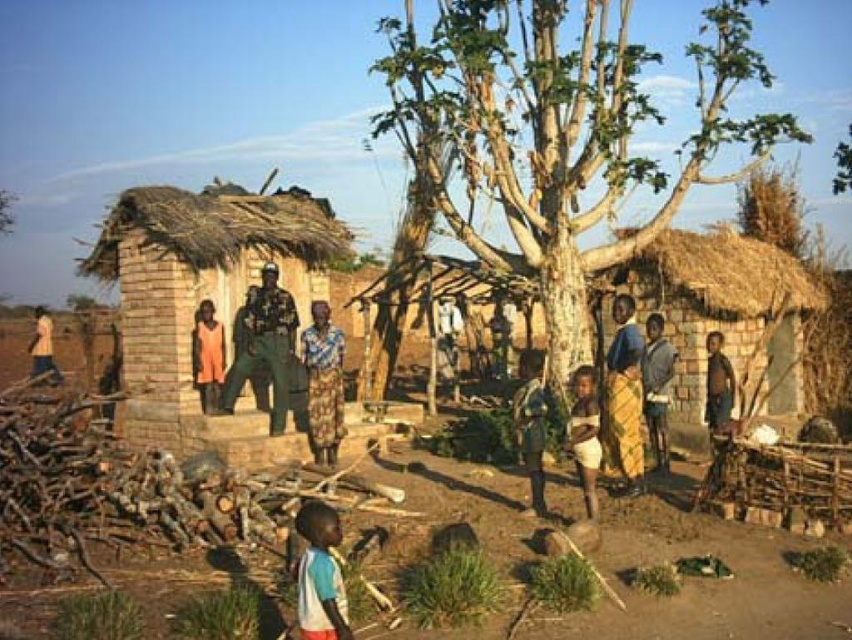
Question: Among these points, which one is farthest from the camera?

Choices:
 (A) (303, 634)
 (B) (182, 189)
 (C) (568, 413)
 (D) (458, 138)

Answer: (B)

Question: Which of the following is the farthest from the observer?

Choices:
 (A) (543, 504)
 (B) (49, 358)
 (C) (561, 38)
 (D) (508, 509)

Answer: (C)

Question: Is light brown wooden stick at center closer to camera compared to light brown skin at center?

Choices:
 (A) yes
 (B) no

Answer: (B)

Question: Can you confirm if light brown wooden stick at center is positioned above light brown skin at center?

Choices:
 (A) yes
 (B) no

Answer: (A)

Question: Which object appears closest to the camera in this image?

Choices:
 (A) brown dirt field at center
 (B) light brown skin at center
 (C) light brown wooden stick at center
 (D) brown rough bark tree at center

Answer: (A)

Question: From the image, what is the correct spatial relationship of brown dirt field at center in relation to light blue t-shirt at lower center?

Choices:
 (A) above
 (B) below

Answer: (A)